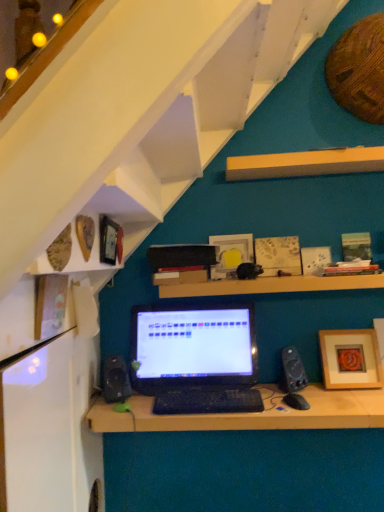
Identify the location of free location to the right of black matte speaker at right, which is the first loudspeaker from right to left. The height and width of the screenshot is (512, 384). (x=322, y=394).